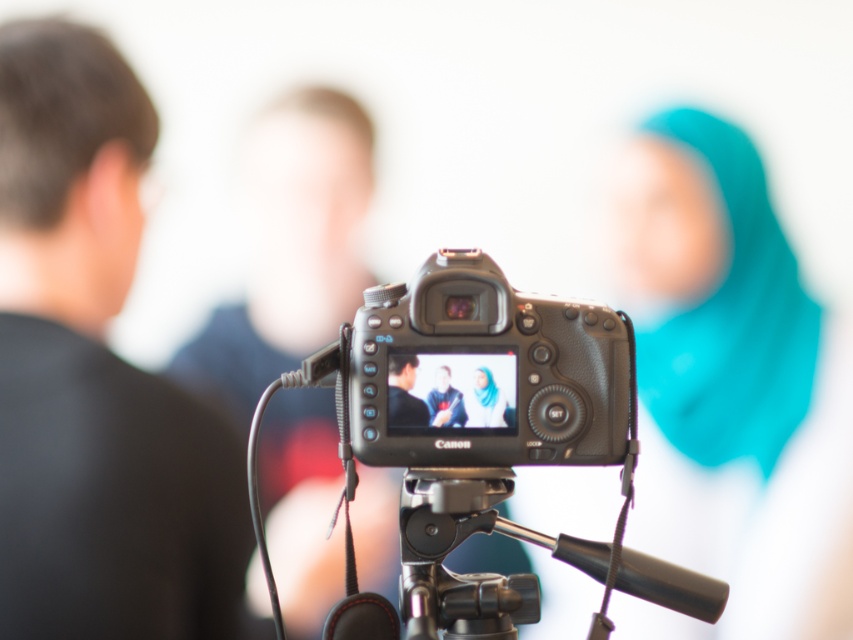
Question: Can you confirm if black textured camera at center is positioned to the left of blue fabric hijab at center?

Choices:
 (A) yes
 (B) no

Answer: (B)

Question: Which object appears closest to the camera in this image?

Choices:
 (A) black plastic tripod at center
 (B) black matte shirt at left
 (C) black matte jacket at center

Answer: (A)

Question: Considering the relative positions of black plastic camera at center and black matte jacket at center in the image provided, where is black plastic camera at center located with respect to black matte jacket at center?

Choices:
 (A) right
 (B) left

Answer: (A)

Question: Which object is the farthest from the black plastic camera at center?

Choices:
 (A) black matte jacket at center
 (B) black plastic tripod at center
 (C) black textured camera at center

Answer: (A)

Question: Which point is closer to the camera?

Choices:
 (A) (509, 596)
 (B) (492, 406)

Answer: (B)

Question: Does black matte jacket at center have a smaller size compared to blue fabric hijab at center?

Choices:
 (A) yes
 (B) no

Answer: (A)